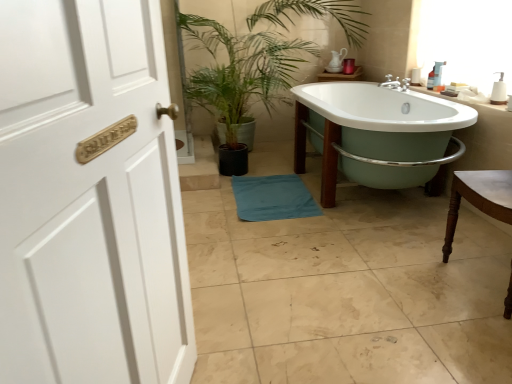
Image resolution: width=512 pixels, height=384 pixels. What do you see at coordinates (257, 58) in the screenshot? I see `green glossy plant at center` at bounding box center [257, 58].

Measure the distance between brown wooden chair at right and camera.

The distance of brown wooden chair at right from camera is 1.55 meters.

Where is `brown wooden chair at right`? brown wooden chair at right is located at coordinates (479, 198).

This screenshot has width=512, height=384. What do you see at coordinates (465, 99) in the screenshot? I see `white ceramic sink at upper right` at bounding box center [465, 99].

Find the location of `green glossy plant at center`. green glossy plant at center is located at coordinates (257, 58).

In the image, is green glossy plant at center positioned in front of or behind white porcelain bathtub at center?

Visually, green glossy plant at center is located behind white porcelain bathtub at center.

Consider the image. Considering the positions of objects green glossy plant at center and white porcelain bathtub at center in the image provided, who is more to the left, green glossy plant at center or white porcelain bathtub at center?

green glossy plant at center.

Between green glossy plant at center and white porcelain bathtub at center, which one has smaller width?

With smaller width is white porcelain bathtub at center.

From a real-world perspective, is green glossy plant at center on white porcelain bathtub at center?

Yes, from a real-world perspective, green glossy plant at center is on top of white porcelain bathtub at center.

Which object is positioned more to the left, green glossy plant at center or brown wooden chair at right?

green glossy plant at center is more to the left.

Is green glossy plant at center looking in the opposite direction of brown wooden chair at right?

green glossy plant at center does not have its back to brown wooden chair at right.

From a real-world perspective, is green glossy plant at center below brown wooden chair at right?

No, from a real-world perspective, green glossy plant at center is not below brown wooden chair at right.

Is green glossy plant at center placed right next to brown wooden chair at right?

No, green glossy plant at center is not making contact with brown wooden chair at right.

Is there a large distance between white ceramic sink at upper right and green glossy plant at center?

Yes.

Is green glossy plant at center at the back of white ceramic sink at upper right?

No, white ceramic sink at upper right is not facing away from green glossy plant at center.

From a real-world perspective, relative to green glossy plant at center, is white ceramic sink at upper right vertically above or below?

white ceramic sink at upper right is below green glossy plant at center.

Choose the correct answer: Is white ceramic sink at upper right inside green glossy plant at center or outside it?

white ceramic sink at upper right is not enclosed by green glossy plant at center.

Considering the sizes of objects brown wooden chair at right and white porcelain bathtub at center in the image provided, who is bigger, brown wooden chair at right or white porcelain bathtub at center?

Bigger between the two is white porcelain bathtub at center.

Is brown wooden chair at right closer to camera compared to white porcelain bathtub at center?

Yes, brown wooden chair at right is closer to the viewer.

Is brown wooden chair at right not within white porcelain bathtub at center?

brown wooden chair at right lies outside white porcelain bathtub at center's area.

Is point (505, 312) positioned before point (388, 119)?

Yes, point (505, 312) is closer to viewer.

Considering the positions of objects white ceramic sink at upper right and brown wooden chair at right in the image provided, who is more to the right, white ceramic sink at upper right or brown wooden chair at right?

white ceramic sink at upper right.

Is white ceramic sink at upper right facing towards brown wooden chair at right?

No, white ceramic sink at upper right is not aimed at brown wooden chair at right.

Does white ceramic sink at upper right have a lesser width compared to brown wooden chair at right?

Indeed, white ceramic sink at upper right has a lesser width compared to brown wooden chair at right.

Which of these two, white ceramic sink at upper right or blue fabric bath towel at center, is smaller?

With smaller size is white ceramic sink at upper right.

Based on the photo, from the image's perspective, which is above, white ceramic sink at upper right or blue fabric bath towel at center?

white ceramic sink at upper right, from the image's perspective.

Is white ceramic sink at upper right outside of blue fabric bath towel at center?

white ceramic sink at upper right lies outside blue fabric bath towel at center's area.

Considering the relative sizes of white ceramic sink at upper right and blue fabric bath towel at center in the image provided, is white ceramic sink at upper right shorter than blue fabric bath towel at center?

Yes, white ceramic sink at upper right is shorter than blue fabric bath towel at center.

From the image's perspective, who appears lower, white porcelain bathtub at center or green glossy plant at center?

white porcelain bathtub at center, from the image's perspective.

Identify the location of houseplant that appears behind the white porcelain bathtub at center. The height and width of the screenshot is (384, 512). (257, 58).

Does white porcelain bathtub at center turn towards green glossy plant at center?

Yes, white porcelain bathtub at center is aimed at green glossy plant at center.

Which is more distant, (366,97) or (237,70)?

The point (237,70) is farther.

Locate an element on the screen. bathtub that appears below the green glossy plant at center (from a real-world perspective) is located at coordinates (381, 108).

Identify the location of houseplant behind the brown wooden chair at right. The image size is (512, 384). (257, 58).

When comparing their distances from white porcelain bathtub at center, does blue fabric bath towel at center or white ceramic sink at upper right seem closer?

The object closer to white porcelain bathtub at center is white ceramic sink at upper right.

Looking at the image, which one is located closer to green glossy plant at center, brown wooden chair at right or white porcelain bathtub at center?

white porcelain bathtub at center.

Looking at the image, which one is located closer to white porcelain bathtub at center, green glossy plant at center or white ceramic sink at upper right?

The object closer to white porcelain bathtub at center is white ceramic sink at upper right.

Looking at the image, which one is located closer to blue fabric bath towel at center, white ceramic sink at upper right or white porcelain bathtub at center?

The object closer to blue fabric bath towel at center is white porcelain bathtub at center.

Looking at the image, which one is located further to white ceramic sink at upper right, white porcelain bathtub at center or brown wooden chair at right?

brown wooden chair at right lies further to white ceramic sink at upper right than the other object.

Based on their spatial positions, is white porcelain bathtub at center or blue fabric bath towel at center further from brown wooden chair at right?

blue fabric bath towel at center lies further to brown wooden chair at right than the other object.

Based on their spatial positions, is green glossy plant at center or white porcelain bathtub at center closer to blue fabric bath towel at center?

white porcelain bathtub at center is closer to blue fabric bath towel at center.

When comparing their distances from green glossy plant at center, does white ceramic sink at upper right or white porcelain bathtub at center seem further?

Based on the image, white ceramic sink at upper right appears to be further to green glossy plant at center.

Locate an element on the screen. The width and height of the screenshot is (512, 384). bathtub between brown wooden chair at right and blue fabric bath towel at center from front to back is located at coordinates (381, 108).

The image size is (512, 384). What are the coordinates of `bathtub between brown wooden chair at right and white ceramic sink at upper right from front to back` in the screenshot? It's located at (381, 108).

Image resolution: width=512 pixels, height=384 pixels. Find the location of `bathtub between green glossy plant at center and white ceramic sink at upper right from left to right`. bathtub between green glossy plant at center and white ceramic sink at upper right from left to right is located at coordinates (381, 108).

The height and width of the screenshot is (384, 512). I want to click on counter top located between brown wooden chair at right and green glossy plant at center in the depth direction, so click(x=465, y=99).